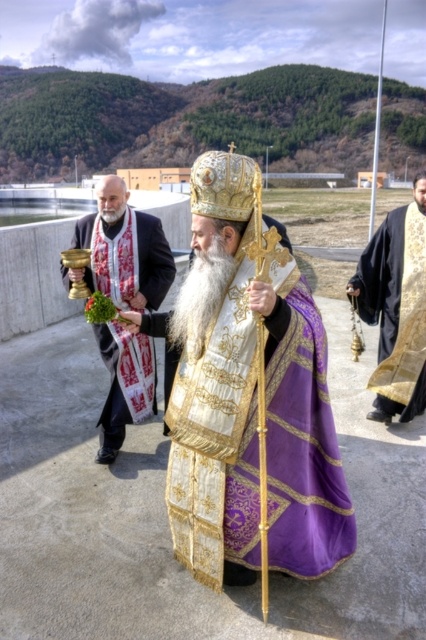
In the scene shown: Can you confirm if purple silk robe at center is positioned below gold metallic chalice at left?

Correct, purple silk robe at center is located below gold metallic chalice at left.

Between purple silk robe at center and gold metallic chalice at left, which one is positioned lower?

purple silk robe at center is lower down.

Which is in front, point (212, 460) or point (138, 365)?

Point (212, 460)

Identify the location of purple silk robe at center. The height and width of the screenshot is (640, 426). (249, 413).

Is point (339, 483) positioned behind point (422, 216)?

No, it is not.

Who is positioned more to the right, purple silk robe at center or black velvet robe at right?

Positioned to the right is black velvet robe at right.

The height and width of the screenshot is (640, 426). Find the location of `purple silk robe at center`. purple silk robe at center is located at coordinates (249, 413).

Does gold metallic chalice at left have a lesser width compared to black velvet robe at right?

Incorrect, gold metallic chalice at left's width is not less than black velvet robe at right's.

Is point (68, 278) more distant than point (406, 419)?

No, it is not.

I want to click on gold metallic chalice at left, so click(123, 250).